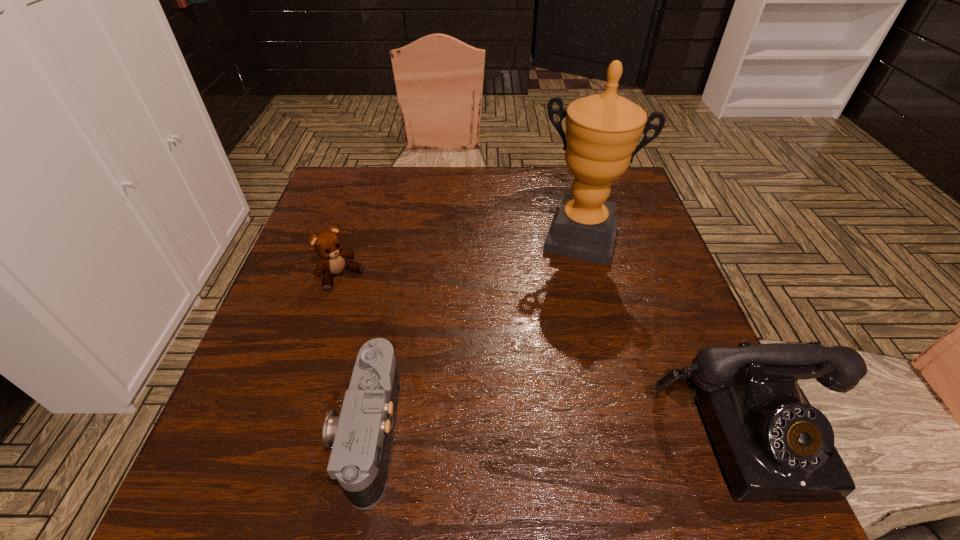
Identify the location of free spot on the desktop that is between the third object from right to left and the third shortest object and is positioned on the front-facing side of the leftmost object. Image resolution: width=960 pixels, height=540 pixels. (503, 432).

At what (x,y) coordinates should I click in order to perform the action: click on free space on the desktop that is between the second object from left to right and the telephone and is positioned at the front of the award with handles. Please return your answer as a coordinate pair (x, y). Looking at the image, I should click on (528, 432).